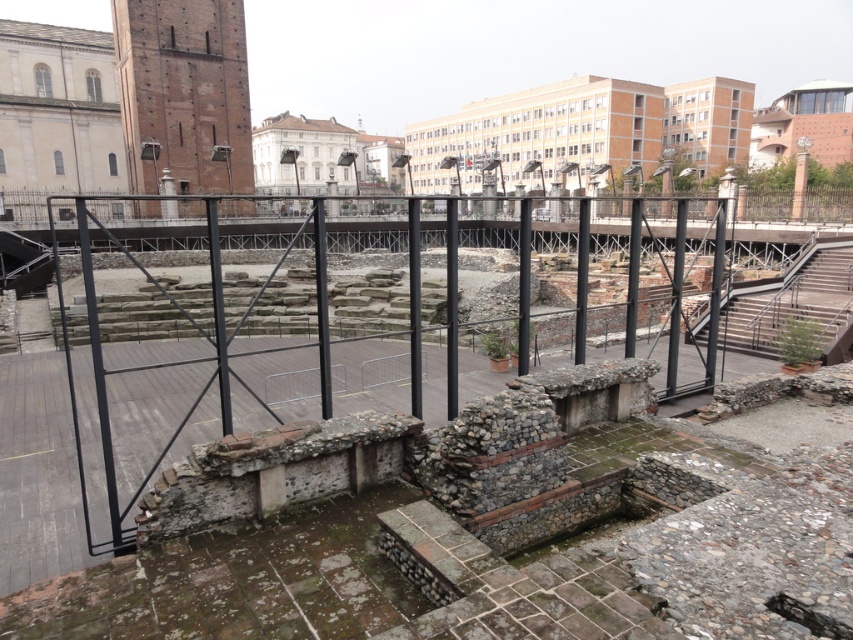
Between brick tower at upper left and rustic stone stairs at right, which one appears on the right side from the viewer's perspective?

rustic stone stairs at right

Is brick tower at upper left thinner than rustic stone stairs at right?

No, brick tower at upper left is not thinner than rustic stone stairs at right.

Between point (112, 19) and point (819, 241), which one is positioned behind?

Positioned behind is point (112, 19).

Find the location of a particular element. The width and height of the screenshot is (853, 640). brick tower at upper left is located at coordinates pos(183,93).